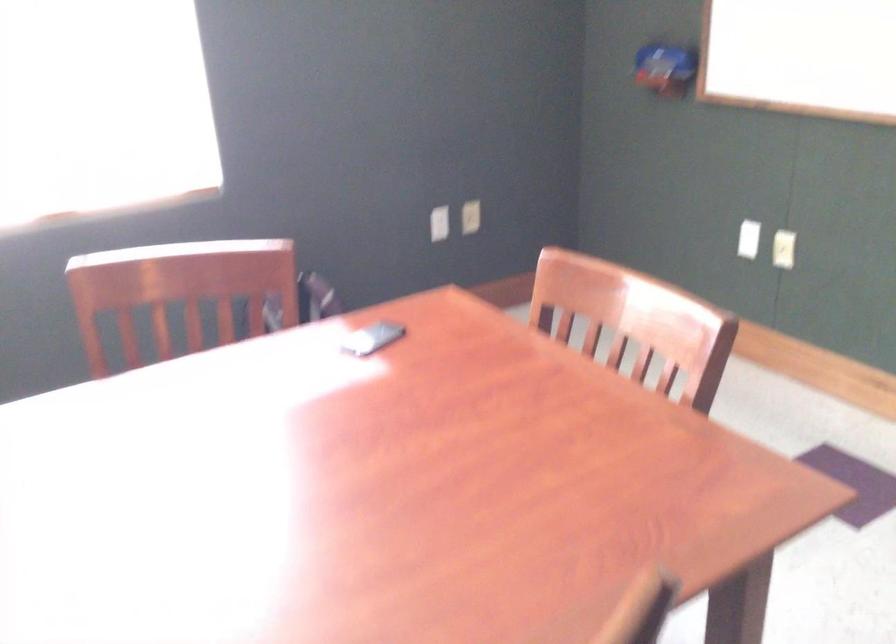
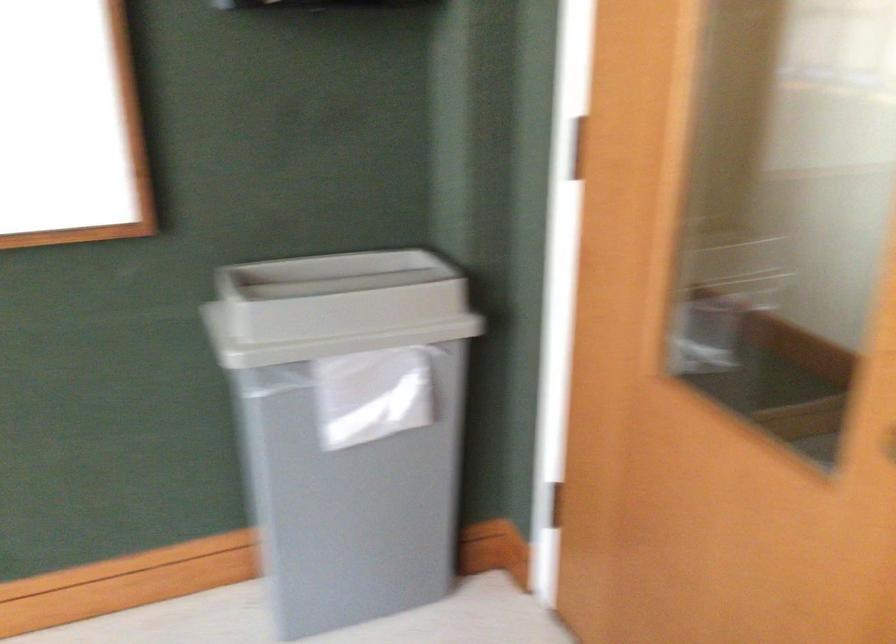
Question: The first image is from the beginning of the video and the second image is from the end. How did the camera likely rotate when shooting the video?

Choices:
 (A) Left
 (B) Right
 (C) Up
 (D) Down

Answer: (B)